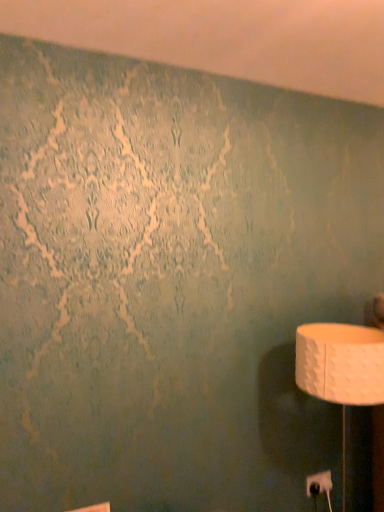
The image size is (384, 512). Describe the element at coordinates (319, 484) in the screenshot. I see `white plastic electric outlet at lower right` at that location.

Where is `white plastic electric outlet at lower right`? Image resolution: width=384 pixels, height=512 pixels. white plastic electric outlet at lower right is located at coordinates (319, 484).

Find the location of `white plastic electric outlet at lower right`. white plastic electric outlet at lower right is located at coordinates (319, 484).